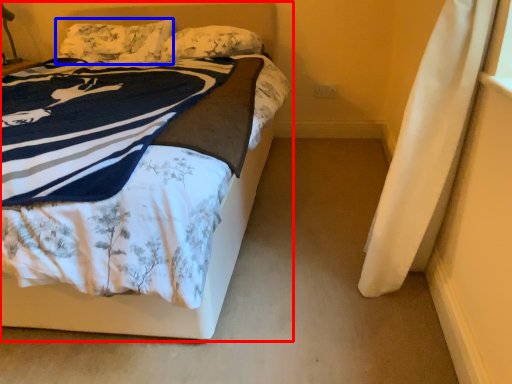
Question: Which point is closer to the camera, bed (highlighted by a red box) or pillow (highlighted by a blue box)?

Choices:
 (A) bed
 (B) pillow

Answer: (A)